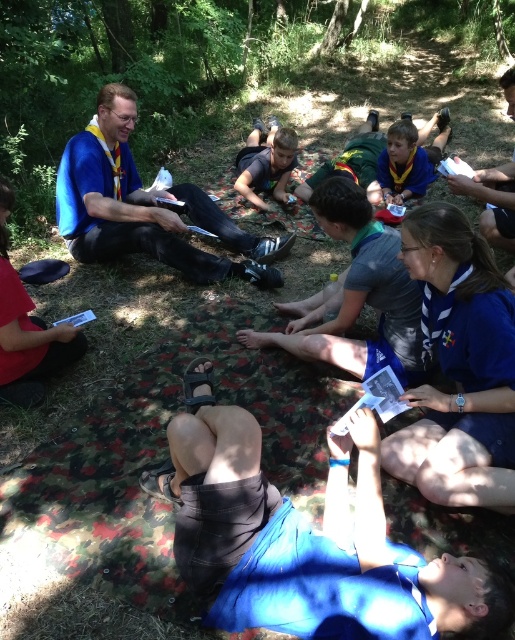
Question: Is blue fabric at lower center further to the viewer compared to matte black phone at center?

Choices:
 (A) no
 (B) yes

Answer: (A)

Question: Is blue fabric at lower center behind matte black phone at center?

Choices:
 (A) yes
 (B) no

Answer: (B)

Question: Does blue fabric at lower center lie in front of matte black phone at center?

Choices:
 (A) no
 (B) yes

Answer: (B)

Question: Which point is closer to the camera?

Choices:
 (A) (375, 586)
 (B) (284, 192)

Answer: (A)